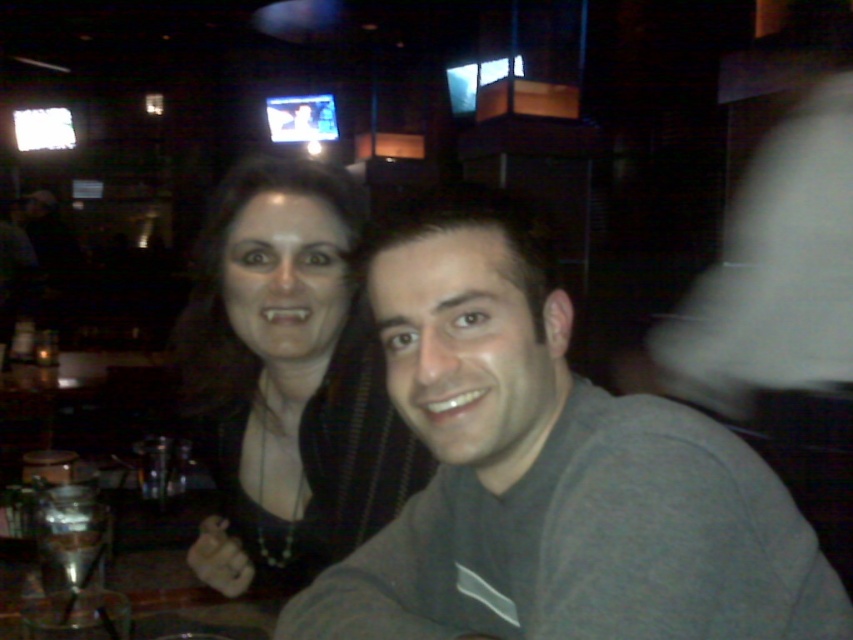
You are a photographer trying to capture a clear shot of both the gray matte shirt at center and the matte black hair at center. Since the scene is dimly lit, you want to ensure both subjects are well illuminated. Which object should you focus on first to ensure proper lighting?

The gray matte shirt at center is in front of the matte black hair at center, so you should focus on the gray matte shirt at center first to ensure it is properly lit before adjusting for the matte black hair at center.

You are taking a photo of the two people at the table. Which object from the scene has a greater width between the gray matte shirt at center and the matte black hair at center?

The gray matte shirt at center has a greater width than the matte black hair at center according to the description.

What is the location of the point with coordinates (x=550, y=472) in the image?

The point with coordinates (x=550, y=472) is located on the gray matte shirt at center.